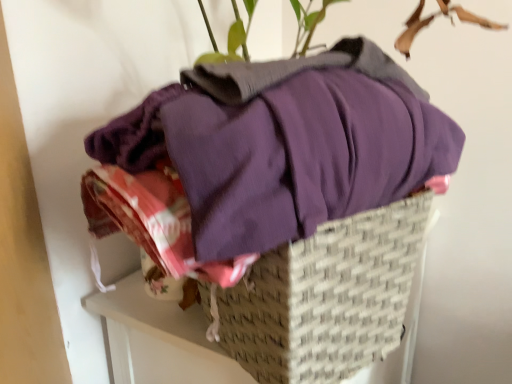
Question: Should I look upward or downward to see green leafy plant at upper center?

Choices:
 (A) up
 (B) down

Answer: (A)

Question: Is purple cotton shirt at center smaller than woven beige basket at center?

Choices:
 (A) yes
 (B) no

Answer: (B)

Question: Is woven beige basket at center surrounded by purple cotton shirt at center?

Choices:
 (A) yes
 (B) no

Answer: (B)

Question: Can you confirm if purple cotton shirt at center is bigger than woven beige basket at center?

Choices:
 (A) yes
 (B) no

Answer: (A)

Question: Is purple cotton shirt at center further to camera compared to woven beige basket at center?

Choices:
 (A) yes
 (B) no

Answer: (B)

Question: Considering the relative sizes of purple cotton shirt at center and woven beige basket at center in the image provided, is purple cotton shirt at center taller than woven beige basket at center?

Choices:
 (A) yes
 (B) no

Answer: (B)

Question: Is purple cotton shirt at center oriented towards woven beige basket at center?

Choices:
 (A) no
 (B) yes

Answer: (A)

Question: Considering the relative sizes of woven beige basket at center and green leafy plant at upper center in the image provided, is woven beige basket at center bigger than green leafy plant at upper center?

Choices:
 (A) no
 (B) yes

Answer: (A)

Question: Could you tell me if woven beige basket at center is facing green leafy plant at upper center?

Choices:
 (A) no
 (B) yes

Answer: (A)

Question: Does woven beige basket at center have a greater height compared to green leafy plant at upper center?

Choices:
 (A) yes
 (B) no

Answer: (A)

Question: Does woven beige basket at center appear on the left side of green leafy plant at upper center?

Choices:
 (A) yes
 (B) no

Answer: (A)

Question: Is woven beige basket at center turned away from green leafy plant at upper center?

Choices:
 (A) yes
 (B) no

Answer: (B)

Question: From the image's perspective, is woven beige basket at center located beneath green leafy plant at upper center?

Choices:
 (A) yes
 (B) no

Answer: (A)

Question: Is green leafy plant at upper center aimed at purple cotton shirt at center?

Choices:
 (A) no
 (B) yes

Answer: (A)